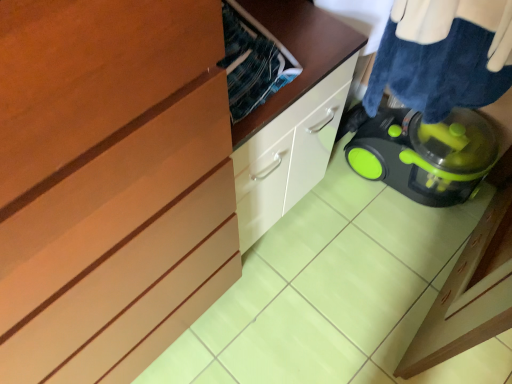
Measure the distance between green plastic laundry basket at lower right and camera.

green plastic laundry basket at lower right is 38.26 inches from camera.

What do you see at coordinates (443, 56) in the screenshot?
I see `green plastic laundry basket at lower right` at bounding box center [443, 56].

This screenshot has height=384, width=512. I want to click on green plastic laundry basket at lower right, so click(x=443, y=56).

What is the approximate width of green plastic laundry basket at lower right?

green plastic laundry basket at lower right is 14.22 inches wide.

This screenshot has height=384, width=512. What do you see at coordinates (109, 187) in the screenshot?
I see `matte wood cabinet at center` at bounding box center [109, 187].

What is the approximate height of matte wood cabinet at center?

matte wood cabinet at center is 70.59 centimeters tall.

Image resolution: width=512 pixels, height=384 pixels. I want to click on matte wood cabinet at center, so click(109, 187).

What is the approximate width of matte wood cabinet at center?

matte wood cabinet at center is 18.21 inches in width.

Locate an element on the screen. The width and height of the screenshot is (512, 384). green plastic laundry basket at lower right is located at coordinates (443, 56).

Is matte wood cabinet at center to the left of green plastic laundry basket at lower right from the viewer's perspective?

Yes.

Is the position of matte wood cabinet at center less distant than that of green plastic laundry basket at lower right?

No, the depth of matte wood cabinet at center is greater than that of green plastic laundry basket at lower right.

Which is less distant, [118,58] or [456,13]?

The point [118,58] is more forward.

From the image's perspective, which object appears higher, matte wood cabinet at center or green plastic laundry basket at lower right?

green plastic laundry basket at lower right is shown above in the image.

From a real-world perspective, is matte wood cabinet at center located beneath green plastic laundry basket at lower right?

Yes, from a real-world perspective, matte wood cabinet at center is under green plastic laundry basket at lower right.

In the scene shown: Considering the sizes of objects matte wood cabinet at center and green plastic laundry basket at lower right in the image provided, who is thinner, matte wood cabinet at center or green plastic laundry basket at lower right?

With smaller width is green plastic laundry basket at lower right.

Considering the relative sizes of matte wood cabinet at center and green plastic laundry basket at lower right in the image provided, is matte wood cabinet at center shorter than green plastic laundry basket at lower right?

In fact, matte wood cabinet at center may be taller than green plastic laundry basket at lower right.

In the scene shown: Which of these two, matte wood cabinet at center or green plastic laundry basket at lower right, is smaller?

With smaller size is green plastic laundry basket at lower right.

Is matte wood cabinet at center completely or partially outside of green plastic laundry basket at lower right?

Indeed, matte wood cabinet at center is completely outside green plastic laundry basket at lower right.

Is matte wood cabinet at center not near green plastic laundry basket at lower right?

No.

Is matte wood cabinet at center facing towards green plastic laundry basket at lower right?

No, matte wood cabinet at center is not facing towards green plastic laundry basket at lower right.

What's the angular difference between matte wood cabinet at center and green plastic laundry basket at lower right's facing directions?

They differ by 90.6 degrees in their facing directions.

Measure the distance from matte wood cabinet at center to green plastic laundry basket at lower right.

matte wood cabinet at center and green plastic laundry basket at lower right are 30.38 inches apart from each other.

Locate an element on the screen. Image resolution: width=512 pixels, height=384 pixels. cabinetry that appears behind the green plastic laundry basket at lower right is located at coordinates (109, 187).

Is green plastic laundry basket at lower right at the right side of matte wood cabinet at center?

Correct, you'll find green plastic laundry basket at lower right to the right of matte wood cabinet at center.

Which object is closer to the camera, green plastic laundry basket at lower right or matte wood cabinet at center?

Positioned in front is green plastic laundry basket at lower right.

Is point (442, 76) closer or farther from the camera than point (48, 371)?

Point (442, 76) is positioned farther from the camera compared to point (48, 371).

From the image's perspective, is green plastic laundry basket at lower right located beneath matte wood cabinet at center?

Incorrect, from the image's perspective, green plastic laundry basket at lower right is higher than matte wood cabinet at center.

From a real-world perspective, which object rests below the other?

matte wood cabinet at center.

Between green plastic laundry basket at lower right and matte wood cabinet at center, which one has larger width?

matte wood cabinet at center is wider.

Who is shorter, green plastic laundry basket at lower right or matte wood cabinet at center?

With less height is green plastic laundry basket at lower right.

In terms of size, does green plastic laundry basket at lower right appear bigger or smaller than matte wood cabinet at center?

Considering their sizes, green plastic laundry basket at lower right takes up less space than matte wood cabinet at center.

Is green plastic laundry basket at lower right inside the boundaries of matte wood cabinet at center, or outside?

green plastic laundry basket at lower right is not enclosed by matte wood cabinet at center.

Is green plastic laundry basket at lower right not close to matte wood cabinet at center?

That's not correct — green plastic laundry basket at lower right is a little close to matte wood cabinet at center.

Is green plastic laundry basket at lower right facing towards matte wood cabinet at center?

Yes, green plastic laundry basket at lower right is turned towards matte wood cabinet at center.

What's the angular difference between green plastic laundry basket at lower right and matte wood cabinet at center's facing directions?

The facing directions of green plastic laundry basket at lower right and matte wood cabinet at center are 90.6 degrees apart.

This screenshot has height=384, width=512. Find the location of `cabinetry below the green plastic laundry basket at lower right (from the image's perspective)`. cabinetry below the green plastic laundry basket at lower right (from the image's perspective) is located at coordinates (109, 187).

The image size is (512, 384). Identify the location of laundry that appears on the right of matte wood cabinet at center. (443, 56).

Locate an element on the screen. The image size is (512, 384). cabinetry directly beneath the green plastic laundry basket at lower right (from a real-world perspective) is located at coordinates (109, 187).